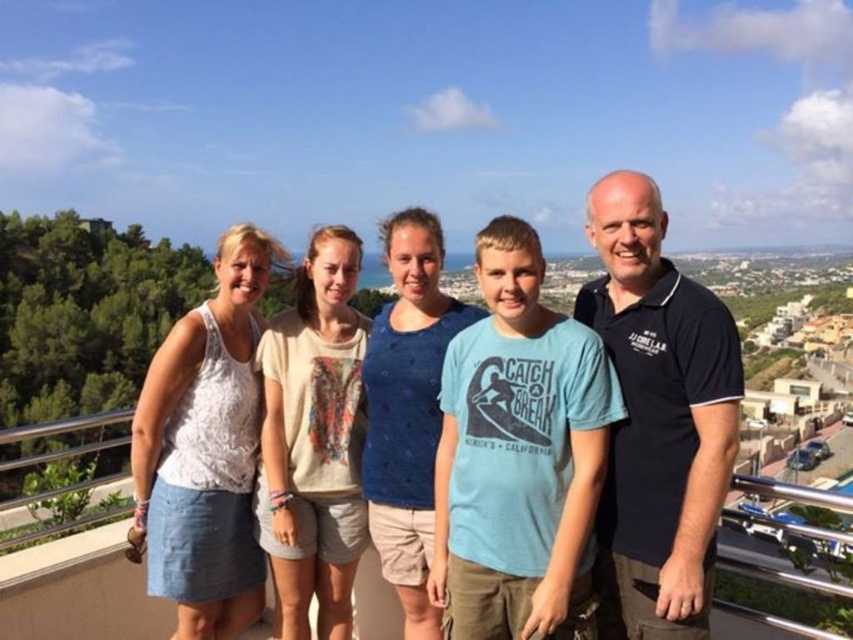
Based on the scene description, which of the two tank tops, the white cotton tank top at center or the white lace tank top at upper left, is positioned higher in the image?

The white cotton tank top at center is taller than the white lace tank top at upper left, so it is positioned higher in the image.

You are a fashion designer observing the group of people. You need to determine which tank top is narrower between the white cotton tank top at center and the white lace tank top at upper left. Which one is narrower?

The white cotton tank top at center is narrower than the white lace tank top at upper left.